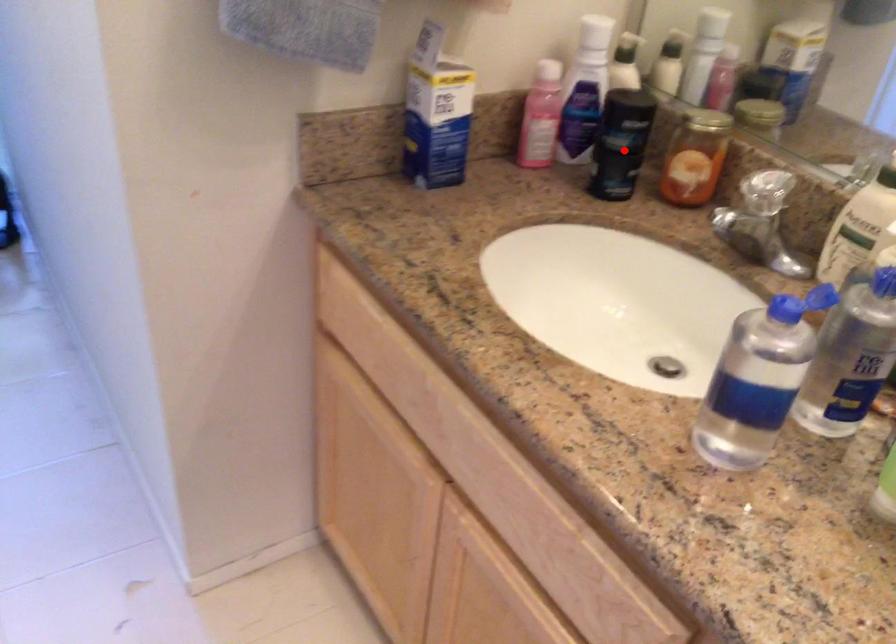
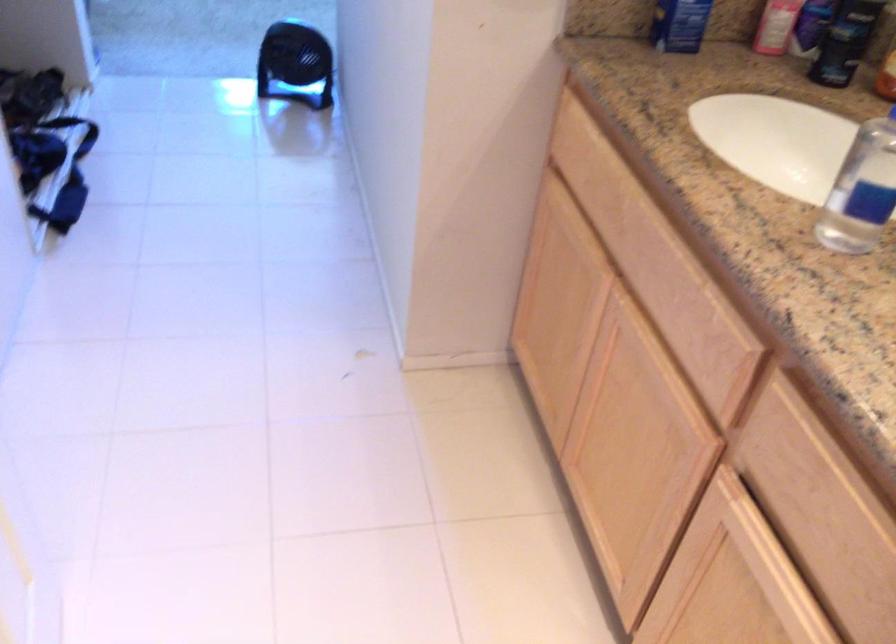
Locate, in the second image, the point that corresponds to the highlighted location in the first image.

(845, 41)